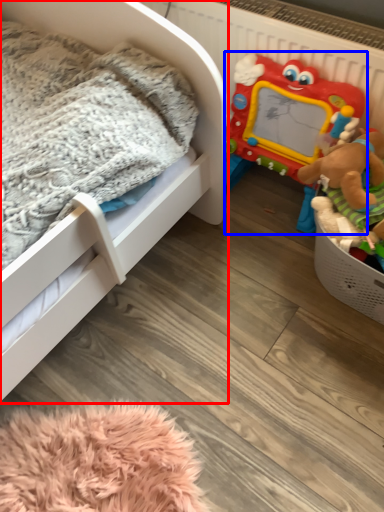
Question: Which point is closer to the camera, infant bed (highlighted by a red box) or toy (highlighted by a blue box)?

Choices:
 (A) infant bed
 (B) toy

Answer: (A)